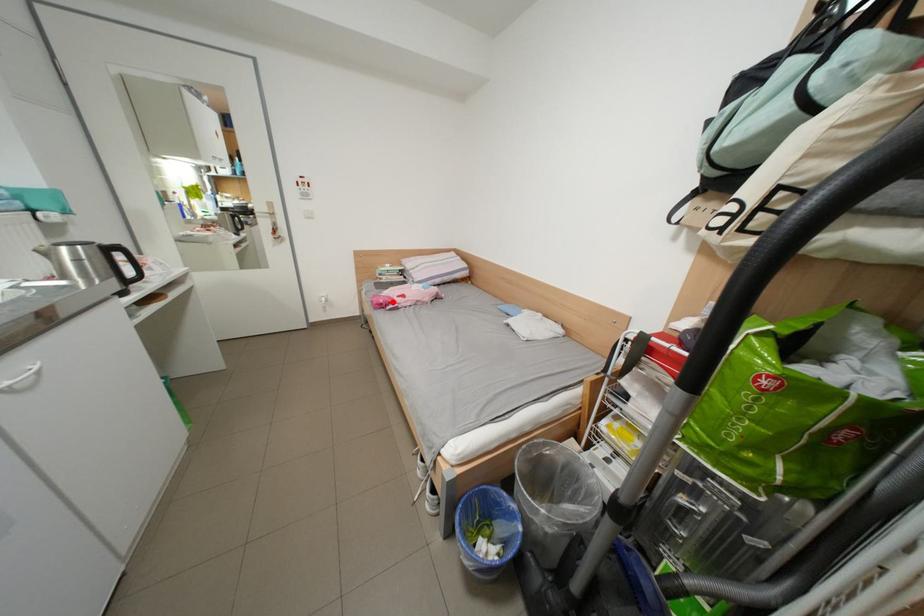
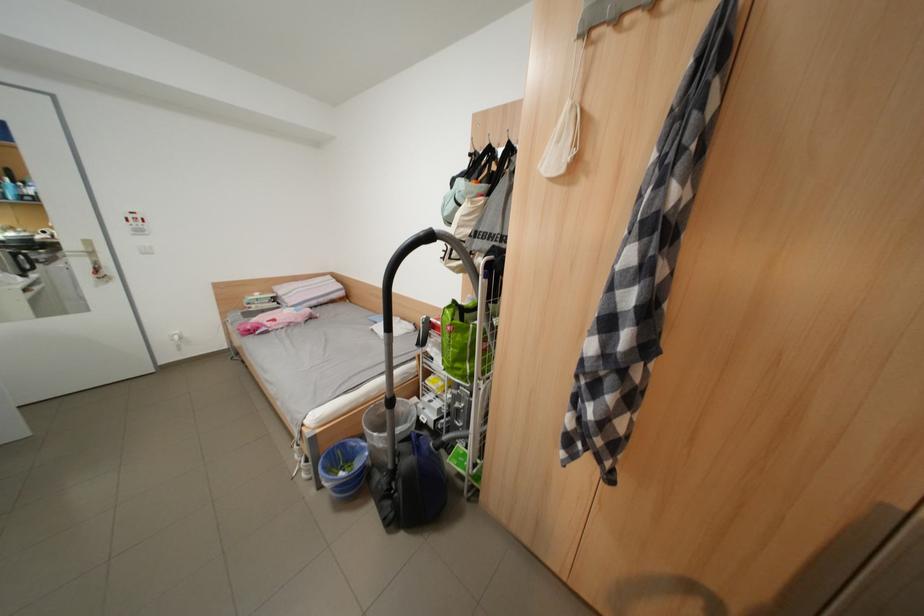
Where in the second image is the point corresponding to the highlighted location from the first image?

(261, 329)